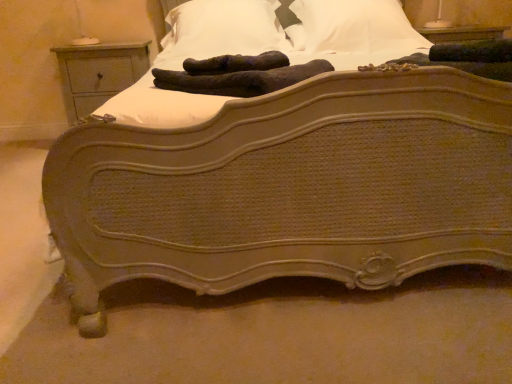
Identify the location of light gray wood nightstand at left. (98, 73).

I want to click on light gray wood nightstand at left, so click(98, 73).

Between white soft pillow at upper center, acting as the first pillow starting from the left, and light gray wood nightstand at left, which one has smaller width?

With smaller width is light gray wood nightstand at left.

Which object is closer to the camera taking this photo, white soft pillow at upper center, which is the 2th pillow from right to left, or light gray wood nightstand at left?

white soft pillow at upper center, which is the 2th pillow from right to left, is in front.

Which point is more forward, (275,16) or (123,50)?

The point (275,16) is more forward.

Is white soft pillow at upper center, which is the 2th pillow from right to left, with light gray wood nightstand at left?

No, white soft pillow at upper center, which is the 2th pillow from right to left, is not with light gray wood nightstand at left.

Consider the image. Considering the relative sizes of white soft pillow at upper center, which ranks as the second pillow in left-to-right order, and light gray wood nightstand at left in the image provided, is white soft pillow at upper center, which ranks as the second pillow in left-to-right order, shorter than light gray wood nightstand at left?

Indeed, white soft pillow at upper center, which ranks as the second pillow in left-to-right order, has a lesser height compared to light gray wood nightstand at left.

From a real-world perspective, does white soft pillow at upper center, which ranks as the second pillow in left-to-right order, stand above light gray wood nightstand at left?

Yes.

Measure the distance from white soft pillow at upper center, which ranks as the second pillow in left-to-right order, to light gray wood nightstand at left.

A distance of 4.11 feet exists between white soft pillow at upper center, which ranks as the second pillow in left-to-right order, and light gray wood nightstand at left.

Is white soft pillow at upper center, the first pillow positioned from the right, to the left or to the right of light gray wood nightstand at left in the image?

white soft pillow at upper center, the first pillow positioned from the right, is positioned on light gray wood nightstand at left's right side.

Relative to white soft pillow at upper center, which is the 2th pillow from right to left, is brown fuzzy gloves at center in front or behind?

Clearly, brown fuzzy gloves at center is in front of white soft pillow at upper center, which is the 2th pillow from right to left.

From a real-world perspective, who is located lower, brown fuzzy gloves at center or white soft pillow at upper center, acting as the first pillow starting from the left?

brown fuzzy gloves at center is physically lower.

From the picture: Between brown fuzzy gloves at center and white soft pillow at upper center, acting as the first pillow starting from the left, which one has larger width?

Wider between the two is white soft pillow at upper center, acting as the first pillow starting from the left.

Choose the correct answer: Is brown fuzzy gloves at center inside white soft pillow at upper center, acting as the first pillow starting from the left, or outside it?

brown fuzzy gloves at center is outside white soft pillow at upper center, acting as the first pillow starting from the left.

Is white soft pillow at upper center, which is the 2th pillow from right to left, placed right next to brown fuzzy gloves at center?

No.

Could you tell me if white soft pillow at upper center, which is the 2th pillow from right to left, is facing brown fuzzy gloves at center?

Yes, white soft pillow at upper center, which is the 2th pillow from right to left, is turned towards brown fuzzy gloves at center.

Does white soft pillow at upper center, acting as the first pillow starting from the left, have a lesser width compared to brown fuzzy gloves at center?

Incorrect, the width of white soft pillow at upper center, acting as the first pillow starting from the left, is not less than that of brown fuzzy gloves at center.

Which object is further away from the camera taking this photo, white soft pillow at upper center, which is the 2th pillow from right to left, or brown fuzzy gloves at center?

white soft pillow at upper center, which is the 2th pillow from right to left, is further away from the camera.

This screenshot has height=384, width=512. I want to click on pillow on the right of brown fuzzy gloves at center, so (355, 26).

Would you consider brown fuzzy gloves at center to be distant from white soft pillow at upper center, the first pillow positioned from the right?

Yes.

Is brown fuzzy gloves at center not within white soft pillow at upper center, which ranks as the second pillow in left-to-right order?

brown fuzzy gloves at center lies outside white soft pillow at upper center, which ranks as the second pillow in left-to-right order,'s area.

Consider the image. Could you tell me if brown fuzzy gloves at center is turned towards white soft pillow at upper center, the first pillow positioned from the right?

No, brown fuzzy gloves at center is not facing towards white soft pillow at upper center, the first pillow positioned from the right.

Considering the sizes of objects light gray wood nightstand at left and white soft pillow at upper center, which is the 2th pillow from right to left, in the image provided, who is shorter, light gray wood nightstand at left or white soft pillow at upper center, which is the 2th pillow from right to left,?

white soft pillow at upper center, which is the 2th pillow from right to left, is shorter.

Measure the distance from light gray wood nightstand at left to white soft pillow at upper center, which is the 2th pillow from right to left.

23.54 inches.

Considering the relative positions of light gray wood nightstand at left and white soft pillow at upper center, acting as the first pillow starting from the left, in the image provided, is light gray wood nightstand at left to the left of white soft pillow at upper center, acting as the first pillow starting from the left, from the viewer's perspective?

Yes, light gray wood nightstand at left is to the left of white soft pillow at upper center, acting as the first pillow starting from the left.

Considering the sizes of light gray wood nightstand at left and white soft pillow at upper center, which is the 2th pillow from right to left, in the image, is light gray wood nightstand at left bigger or smaller than white soft pillow at upper center, which is the 2th pillow from right to left,?

Considering their sizes, light gray wood nightstand at left takes up less space than white soft pillow at upper center, which is the 2th pillow from right to left.

Is point (217, 88) closer or farther from the camera than point (83, 73)?

Point (217, 88) appears to be closer to the viewer than point (83, 73).

From the image's perspective, is brown fuzzy gloves at center below light gray wood nightstand at left?

Yes, from the image's perspective, brown fuzzy gloves at center is below light gray wood nightstand at left.

Can you tell me how much brown fuzzy gloves at center and light gray wood nightstand at left differ in facing direction?

The facing directions of brown fuzzy gloves at center and light gray wood nightstand at left are 45 degrees apart.

Identify the location of nightstand below the white soft pillow at upper center, acting as the first pillow starting from the left (from a real-world perspective). (98, 73).

From a real-world perspective, which pillow is the 1st one above the light gray wood nightstand at left? Please provide its 2D coordinates.

[(355, 26)]

Considering their positions, is white soft pillow at upper center, which is the 2th pillow from right to left, positioned further to light gray wood nightstand at left than white soft pillow at upper center, the first pillow positioned from the right?

The object further to light gray wood nightstand at left is white soft pillow at upper center, the first pillow positioned from the right.

Looking at the image, which one is located further to light gray wood nightstand at left, white soft pillow at upper center, which ranks as the second pillow in left-to-right order, or brown fuzzy gloves at center?

brown fuzzy gloves at center is positioned further to the anchor light gray wood nightstand at left.

When comparing their distances from white soft pillow at upper center, acting as the first pillow starting from the left, does brown fuzzy gloves at center or white soft pillow at upper center, which ranks as the second pillow in left-to-right order, seem closer?

white soft pillow at upper center, which ranks as the second pillow in left-to-right order.

Which object lies further to the anchor point white soft pillow at upper center, which is the 2th pillow from right to left, light gray wood nightstand at left or brown fuzzy gloves at center?

brown fuzzy gloves at center is further to white soft pillow at upper center, which is the 2th pillow from right to left.

Considering their positions, is white soft pillow at upper center, which is the 2th pillow from right to left, positioned further to brown fuzzy gloves at center than white soft pillow at upper center, which ranks as the second pillow in left-to-right order?

Among the two, white soft pillow at upper center, which ranks as the second pillow in left-to-right order, is located further to brown fuzzy gloves at center.

Considering their positions, is white soft pillow at upper center, the first pillow positioned from the right, positioned closer to brown fuzzy gloves at center than white soft pillow at upper center, which is the 2th pillow from right to left?

white soft pillow at upper center, which is the 2th pillow from right to left, lies closer to brown fuzzy gloves at center than the other object.

From the image, which object appears to be nearer to white soft pillow at upper center, acting as the first pillow starting from the left, brown fuzzy gloves at center or light gray wood nightstand at left?

The object closer to white soft pillow at upper center, acting as the first pillow starting from the left, is light gray wood nightstand at left.

When comparing their distances from white soft pillow at upper center, the first pillow positioned from the right, does light gray wood nightstand at left or brown fuzzy gloves at center seem closer?

Among the two, brown fuzzy gloves at center is located nearer to white soft pillow at upper center, the first pillow positioned from the right.

Identify the location of material located between light gray wood nightstand at left and white soft pillow at upper center, which ranks as the second pillow in left-to-right order, in the left-right direction. (240, 80).

Find the location of a particular element. The width and height of the screenshot is (512, 384). pillow between light gray wood nightstand at left and white soft pillow at upper center, which ranks as the second pillow in left-to-right order, in the horizontal direction is located at coordinates [x=224, y=28].

You are a GUI agent. You are given a task and a screenshot of the screen. Output one action in this format:
    pyautogui.click(x=<x>, y=<y>)
    Task: Click on the pillow located between brown fuzzy gloves at center and white soft pillow at upper center, which ranks as the second pillow in left-to-right order, in the depth direction
    The height and width of the screenshot is (384, 512).
    Given the screenshot: What is the action you would take?
    pyautogui.click(x=224, y=28)